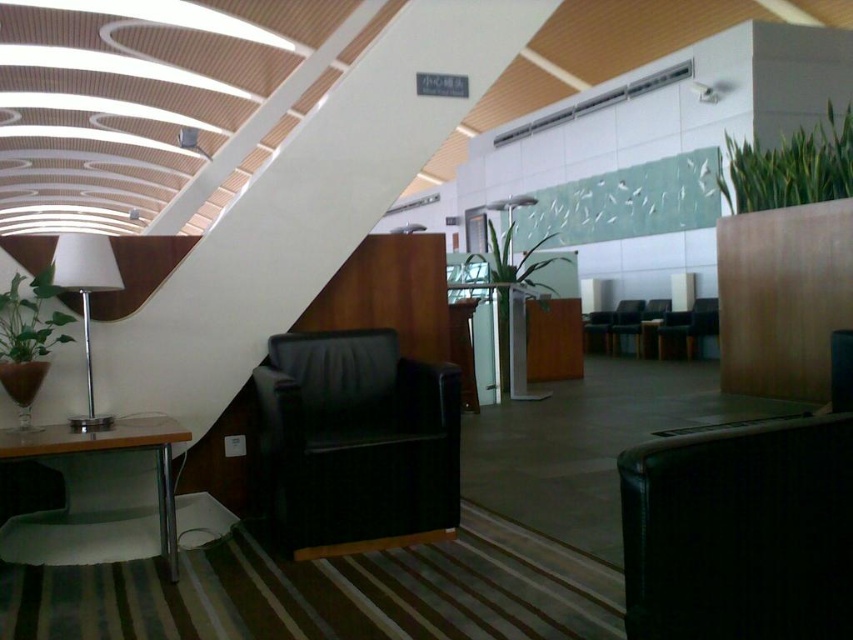
Question: Does black leather swivel chair at center have a greater width compared to white matte lamp at left?

Choices:
 (A) no
 (B) yes

Answer: (B)

Question: Which of the following is the closest to the observer?

Choices:
 (A) green leafy plant at upper right
 (B) white matte lamp at left
 (C) metallic silver table at lower left
 (D) green matte plant at left

Answer: (C)

Question: Can you confirm if green leafy plant at upper right is smaller than white matte lamp at left?

Choices:
 (A) yes
 (B) no

Answer: (B)

Question: Among these points, which one is nearest to the camera?

Choices:
 (A) (3, 305)
 (B) (86, 390)
 (C) (537, 260)
 (D) (361, 538)

Answer: (A)

Question: Can you confirm if white matte lamp at left is positioned below green leafy plant at center?

Choices:
 (A) yes
 (B) no

Answer: (A)

Question: Which is nearer to the metallic silver table at lower left?

Choices:
 (A) green leafy plant at upper right
 (B) green matte plant at left
 (C) white matte lamp at left

Answer: (C)